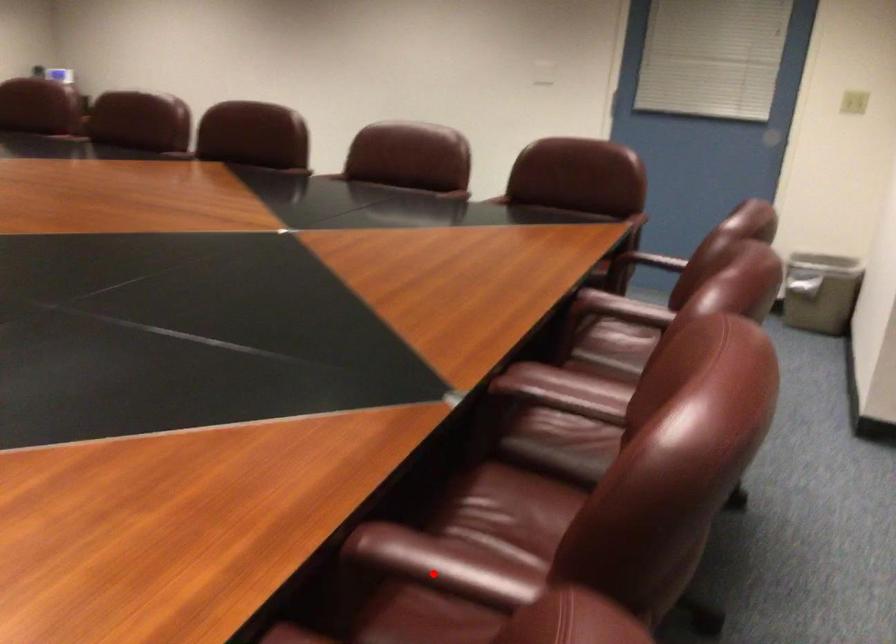
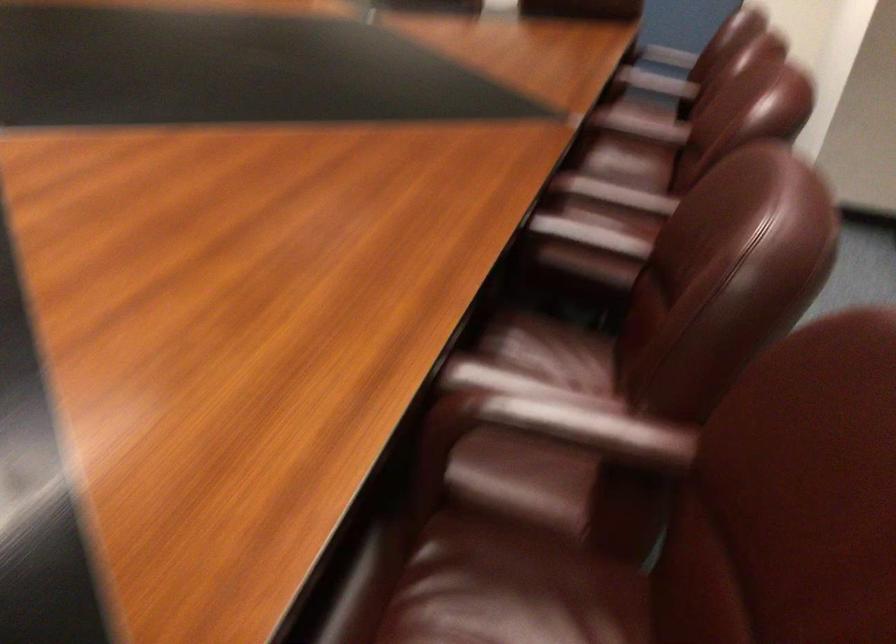
Question: I am providing you with two images of the same scene from different viewpoints. Given a red point in image1, look at the same physical point in image2. Is it:

Choices:
 (A) Closer to the viewpoint
 (B) Farther from the viewpoint

Answer: (B)